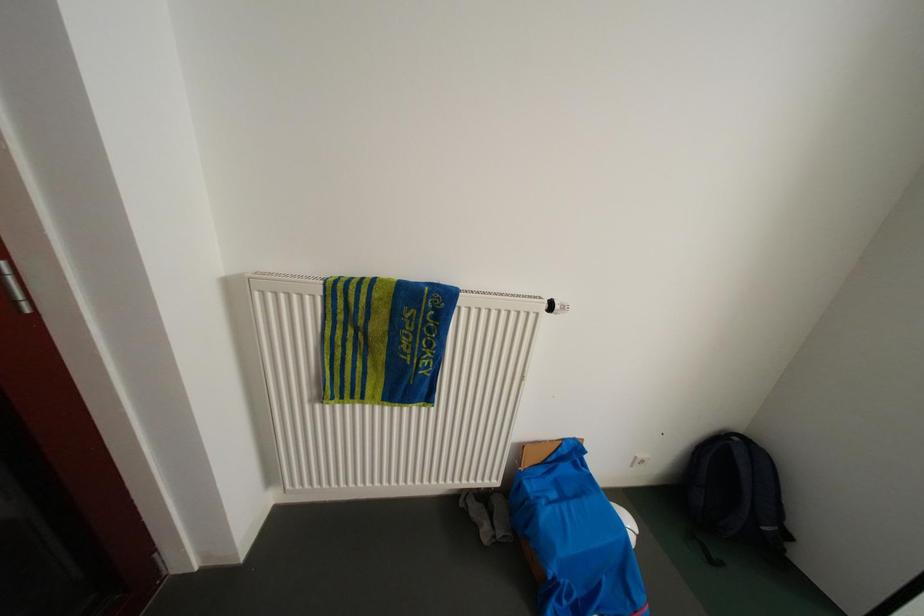
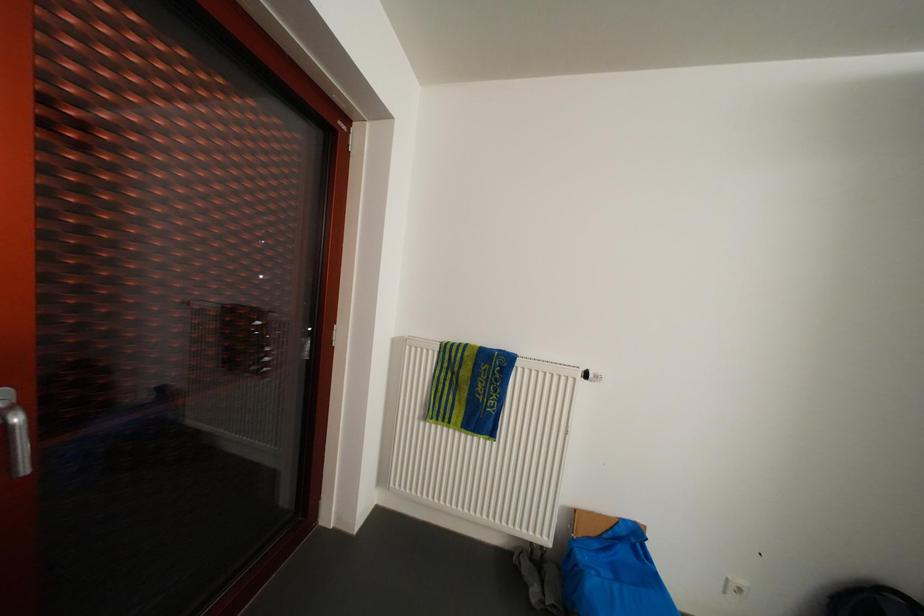
Question: Which direction would the cameraman need to move to produce the second image? Reply with the corresponding letter.

Choices:
 (A) Left
 (B) Right
 (C) Forward
 (D) Backward

Answer: (D)